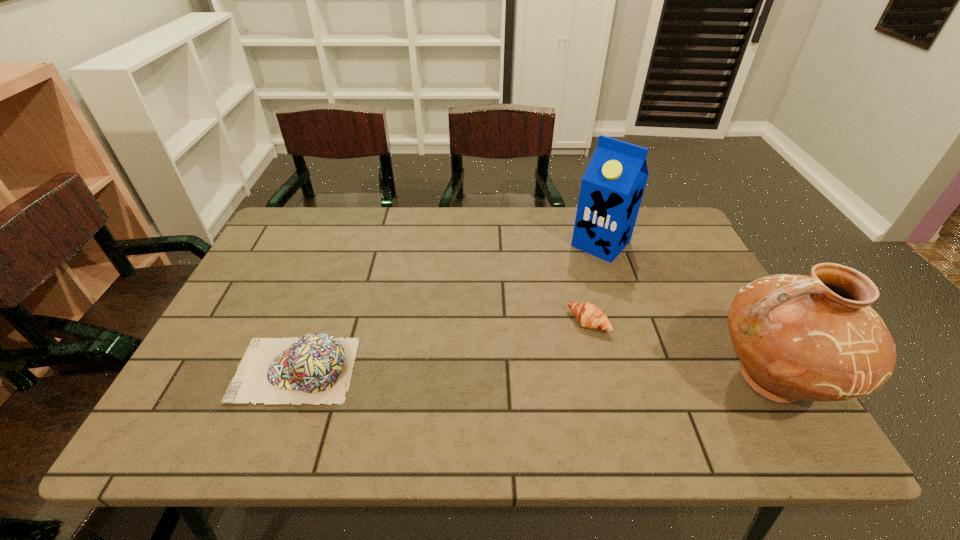
I want to click on vacant space on the desktop that is between the third tallest object and the rightmost object and is positioned with the cap open on the farthest object, so pos(477,374).

In order to click on vacant space on the desktop that is between the second shortest object and the rightmost object and is positioned on the front-facing side of the pastry in this screenshot , I will do `click(534, 375)`.